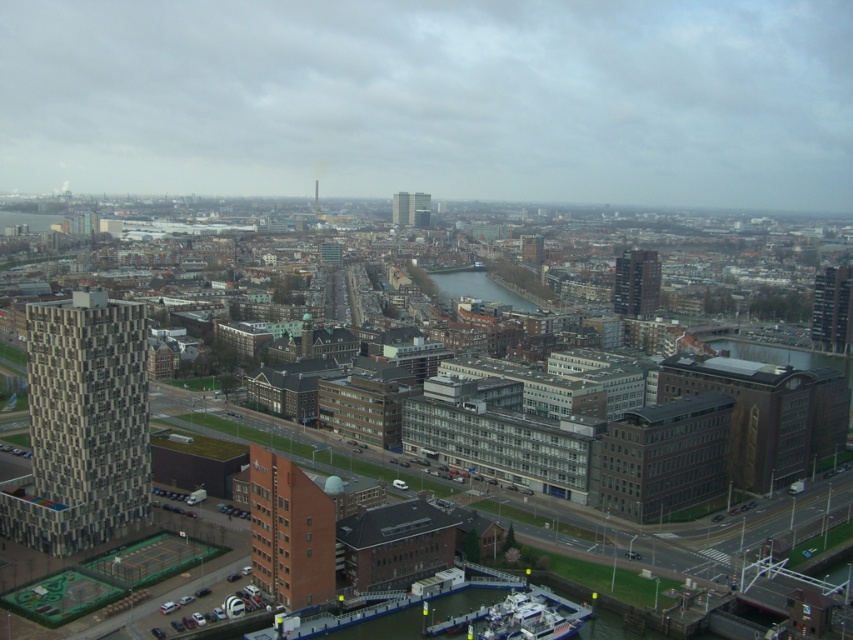
Is dark gray concrete skyscraper at center-right above dark blue water at center?

Yes.

Does point (625, 252) come farther from viewer compared to point (529, 305)?

Yes.

Identify the location of dark gray concrete skyscraper at center-right. (636, 282).

Does point (833, 301) come closer to viewer compared to point (651, 259)?

Yes, point (833, 301) is in front of point (651, 259).

Which is behind, point (830, 282) or point (645, 273)?

Point (645, 273)

Where is `dark gray concrete building at right`? Image resolution: width=853 pixels, height=640 pixels. dark gray concrete building at right is located at coordinates (833, 307).

Does point (651, 262) lie in front of point (393, 204)?

Yes, it is in front of point (393, 204).

Who is more forward, (648,296) or (402,198)?

Point (648,296)

Describe the element at coordinates (636, 282) in the screenshot. I see `dark gray concrete skyscraper at center-right` at that location.

The width and height of the screenshot is (853, 640). I want to click on dark gray concrete skyscraper at center-right, so click(636, 282).